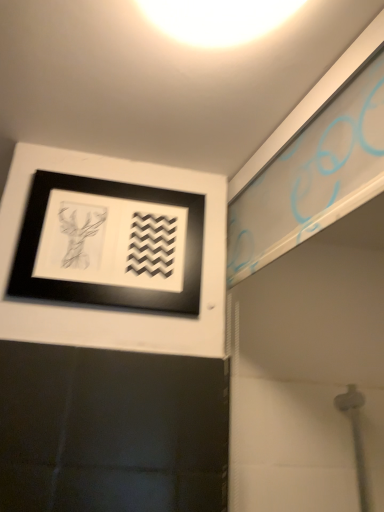
What do you see at coordinates (112, 254) in the screenshot?
I see `black matte picture frame at upper left` at bounding box center [112, 254].

Where is `black matte picture frame at upper left`? black matte picture frame at upper left is located at coordinates (112, 254).

This screenshot has height=512, width=384. What are the coordinates of `white glossy light at upper center` in the screenshot? It's located at (217, 20).

The height and width of the screenshot is (512, 384). What do you see at coordinates (217, 20) in the screenshot?
I see `white glossy light at upper center` at bounding box center [217, 20].

In order to click on black matte picture frame at upper left in this screenshot , I will do pyautogui.click(x=112, y=254).

Is black matte picture frame at upper left to the right of white glossy light at upper center from the viewer's perspective?

No, black matte picture frame at upper left is not to the right of white glossy light at upper center.

In the image, is black matte picture frame at upper left positioned in front of or behind white glossy light at upper center?

Visually, black matte picture frame at upper left is located behind white glossy light at upper center.

Which point is more forward, (207,257) or (214,14)?

The point (214,14) is in front.

From the image's perspective, which one is positioned higher, black matte picture frame at upper left or white glossy light at upper center?

From the image's view, white glossy light at upper center is above.

From the picture: From a real-world perspective, is black matte picture frame at upper left physically located above or below white glossy light at upper center?

Clearly, from a real-world perspective, black matte picture frame at upper left is below white glossy light at upper center.

Does black matte picture frame at upper left have a greater width compared to white glossy light at upper center?

No, black matte picture frame at upper left is not wider than white glossy light at upper center.

In terms of height, does black matte picture frame at upper left look taller or shorter compared to white glossy light at upper center?

black matte picture frame at upper left is taller than white glossy light at upper center.

Does black matte picture frame at upper left have a smaller size compared to white glossy light at upper center?

Indeed, black matte picture frame at upper left has a smaller size compared to white glossy light at upper center.

Would you say black matte picture frame at upper left is inside or outside white glossy light at upper center?

black matte picture frame at upper left is located beyond the bounds of white glossy light at upper center.

Is black matte picture frame at upper left touching white glossy light at upper center?

No, black matte picture frame at upper left is not next to white glossy light at upper center.

Does black matte picture frame at upper left turn towards white glossy light at upper center?

Yes, black matte picture frame at upper left is facing white glossy light at upper center.

How many degrees apart are the facing directions of black matte picture frame at upper left and white glossy light at upper center?

4.91 degrees.

What are the coordinates of `picture frame below the white glossy light at upper center (from a real-world perspective)` in the screenshot? It's located at (112, 254).

Considering the positions of objects white glossy light at upper center and black matte picture frame at upper left in the image provided, who is more to the right, white glossy light at upper center or black matte picture frame at upper left?

Positioned to the right is white glossy light at upper center.

Considering the positions of objects white glossy light at upper center and black matte picture frame at upper left in the image provided, who is behind, white glossy light at upper center or black matte picture frame at upper left?

black matte picture frame at upper left is further from the camera.

Is point (152, 10) positioned after point (66, 282)?

No.

From the image's perspective, which one is positioned lower, white glossy light at upper center or black matte picture frame at upper left?

From the image's view, black matte picture frame at upper left is below.

In the scene shown: From a real-world perspective, is white glossy light at upper center physically above black matte picture frame at upper left?

Yes, from a real-world perspective, white glossy light at upper center is on top of black matte picture frame at upper left.

Is white glossy light at upper center thinner than black matte picture frame at upper left?

In fact, white glossy light at upper center might be wider than black matte picture frame at upper left.

Is white glossy light at upper center taller or shorter than black matte picture frame at upper left?

In the image, white glossy light at upper center appears to be shorter than black matte picture frame at upper left.

Considering the sizes of objects white glossy light at upper center and black matte picture frame at upper left in the image provided, who is smaller, white glossy light at upper center or black matte picture frame at upper left?

Smaller between the two is black matte picture frame at upper left.

Is white glossy light at upper center positioned beyond the bounds of black matte picture frame at upper left?

white glossy light at upper center lies outside black matte picture frame at upper left's area.

Is white glossy light at upper center beside black matte picture frame at upper left?

No.

Is white glossy light at upper center facing away from black matte picture frame at upper left?

No, white glossy light at upper center is not facing away from black matte picture frame at upper left.

What's the angular difference between white glossy light at upper center and black matte picture frame at upper left's facing directions?

There is a 4.91-degree angle between the facing directions of white glossy light at upper center and black matte picture frame at upper left.

Locate an element on the screen. light in front of the black matte picture frame at upper left is located at coordinates (217, 20).

This screenshot has width=384, height=512. In order to click on light on the right of black matte picture frame at upper left in this screenshot , I will do `click(217, 20)`.

The width and height of the screenshot is (384, 512). What are the coordinates of `picture frame behind the white glossy light at upper center` in the screenshot? It's located at (112, 254).